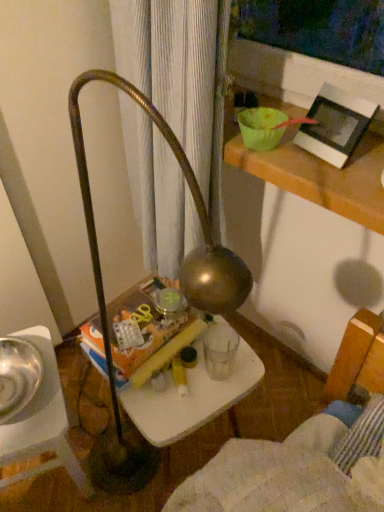
Measure the distance between metallic silver bowl at lower left and camera.

They are 33.63 inches apart.

This screenshot has width=384, height=512. What do you see at coordinates (170, 380) in the screenshot?
I see `white plastic table at center` at bounding box center [170, 380].

The height and width of the screenshot is (512, 384). Find the location of `metallic silver bowl at lower left`. metallic silver bowl at lower left is located at coordinates (42, 422).

From a real-world perspective, is shiny metallic bowl at left over metallic silver bowl at lower left?

Correct, in the physical world, shiny metallic bowl at left is higher than metallic silver bowl at lower left.

Is shiny metallic bowl at left not close to metallic silver bowl at lower left?

They are positioned close to each other.

Is shiny metallic bowl at left positioned before metallic silver bowl at lower left?

Yes, it is in front of metallic silver bowl at lower left.

Is point (6, 354) more distant than point (358, 98)?

Yes, point (6, 354) is behind point (358, 98).

In terms of size, does shiny metallic bowl at left appear bigger or smaller than white matte picture frame at upper right?

Clearly, shiny metallic bowl at left is larger in size than white matte picture frame at upper right.

Is shiny metallic bowl at left aimed at white matte picture frame at upper right?

No, shiny metallic bowl at left is not oriented towards white matte picture frame at upper right.

The height and width of the screenshot is (512, 384). I want to click on glass bowl that appears on the left of white matte picture frame at upper right, so click(18, 375).

Which of these two, white plastic table at center or white matte picture frame at upper right, is bigger?

white plastic table at center.

This screenshot has height=512, width=384. In order to click on table on the left of the white matte picture frame at upper right in this screenshot , I will do `click(170, 380)`.

Does point (174, 345) come behind point (365, 128)?

Yes, it is.

Are white plastic table at center and white matte picture frame at upper right beside each other?

No, white plastic table at center is not next to white matte picture frame at upper right.

Is white matte picture frame at upper right smaller than metallic silver bowl at lower left?

Yes.

Considering the relative positions of white matte picture frame at upper right and metallic silver bowl at lower left in the image provided, is white matte picture frame at upper right in front of metallic silver bowl at lower left?

That is True.

From a real-world perspective, which object rests below the other?

metallic silver bowl at lower left, from a real-world perspective.

Considering the sizes of objects white matte picture frame at upper right and white plastic table at center in the image provided, who is bigger, white matte picture frame at upper right or white plastic table at center?

white plastic table at center is bigger.

You are a GUI agent. You are given a task and a screenshot of the screen. Output one action in this format:
    pyautogui.click(x=<x>, y=<y>)
    Task: Click on the table located below the white matte picture frame at upper right (from the image's perspective)
    The height and width of the screenshot is (512, 384).
    Given the screenshot: What is the action you would take?
    pyautogui.click(x=170, y=380)

Which object is further away from the camera, white matte picture frame at upper right or white plastic table at center?

white plastic table at center is further away from the camera.

Does white matte picture frame at upper right turn towards shiny metallic bowl at left?

No, white matte picture frame at upper right is not facing towards shiny metallic bowl at left.

Does white matte picture frame at upper right have a greater width compared to shiny metallic bowl at left?

In fact, white matte picture frame at upper right might be narrower than shiny metallic bowl at left.

Consider the image. Is white matte picture frame at upper right far from shiny metallic bowl at left?

That's not correct — white matte picture frame at upper right is a little close to shiny metallic bowl at left.

Does point (301, 120) come closer to viewer compared to point (25, 355)?

That is True.

Is metallic silver bowl at lower left outside of white plastic table at center?

Yes, metallic silver bowl at lower left is located beyond the bounds of white plastic table at center.

Which is behind, point (5, 486) or point (240, 342)?

The point (5, 486) is more distant.

Who is shorter, metallic silver bowl at lower left or white plastic table at center?

With less height is white plastic table at center.

From the image's perspective, which one is positioned higher, metallic silver bowl at lower left or white plastic table at center?

From the image's view, white plastic table at center is above.

This screenshot has width=384, height=512. I want to click on glass bowl above the metallic silver bowl at lower left (from a real-world perspective), so click(x=18, y=375).

Find the location of a particular element. This screenshot has height=512, width=384. glass bowl to the left of white matte picture frame at upper right is located at coordinates (18, 375).

Considering their positions, is metallic silver bowl at lower left positioned further to shiny metallic bowl at left than white plastic table at center?

white plastic table at center is positioned further to the anchor shiny metallic bowl at left.

Looking at this image, from the image, which object appears to be farther from shiny metallic bowl at left, white matte picture frame at upper right or white plastic table at center?

Based on the image, white matte picture frame at upper right appears to be further to shiny metallic bowl at left.

Considering their positions, is white plastic table at center positioned further to metallic silver bowl at lower left than white matte picture frame at upper right?

white matte picture frame at upper right is further to metallic silver bowl at lower left.

Based on their spatial positions, is metallic silver bowl at lower left or shiny metallic bowl at left closer to white plastic table at center?

The object closer to white plastic table at center is metallic silver bowl at lower left.

Estimate the real-world distances between objects in this image. Which object is further from white plastic table at center, shiny metallic bowl at left or white matte picture frame at upper right?

Based on the image, white matte picture frame at upper right appears to be further to white plastic table at center.

Based on their spatial positions, is metallic silver bowl at lower left or white matte picture frame at upper right closer to white plastic table at center?

Based on the image, metallic silver bowl at lower left appears to be nearer to white plastic table at center.

From the image, which object appears to be nearer to white plastic table at center, white matte picture frame at upper right or metallic silver bowl at lower left?

The object closer to white plastic table at center is metallic silver bowl at lower left.

From the image, which object appears to be nearer to shiny metallic bowl at left, metallic silver bowl at lower left or white matte picture frame at upper right?

metallic silver bowl at lower left is closer to shiny metallic bowl at left.

Locate an element on the screen. The width and height of the screenshot is (384, 512). glass bowl between metallic silver bowl at lower left and white plastic table at center from left to right is located at coordinates (18, 375).

The height and width of the screenshot is (512, 384). I want to click on table between white matte picture frame at upper right and metallic silver bowl at lower left from top to bottom, so click(170, 380).

Locate an element on the screen. The image size is (384, 512). glass bowl located between metallic silver bowl at lower left and white matte picture frame at upper right in the left-right direction is located at coordinates (18, 375).

Locate an element on the screen. This screenshot has height=512, width=384. table between shiny metallic bowl at left and white matte picture frame at upper right in the horizontal direction is located at coordinates (170, 380).